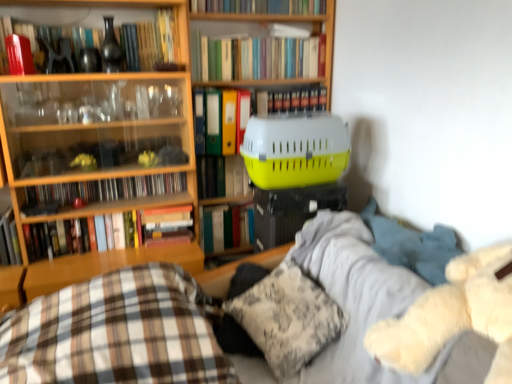
Question: From a real-world perspective, is yellow plastic pet carrier at upper right physically located above or below matte black vase at upper left, the fourth book positioned from the top?

Choices:
 (A) above
 (B) below

Answer: (B)

Question: Is point (331, 172) closer or farther from the camera than point (173, 43)?

Choices:
 (A) farther
 (B) closer

Answer: (B)

Question: Considering the real-world distances, which object is closest to the hardcover book at center, positioned as the tenth book in top-to-bottom order?

Choices:
 (A) hardcover book at upper center, which is the 1th book from top to bottom
 (B) hardcover book at center, the seventh book positioned from the top
 (C) wooden bookcase at center
 (D) yellow plastic pet carrier at upper right
 (E) yellow matte file folder at center, which appears as the 6th book when ordered from the bottom

Answer: (B)

Question: Which is farther from the hardcover book at center, positioned as the tenth book in top-to-bottom order?

Choices:
 (A) yellow plastic pet carrier at upper right
 (B) matte black book at left, placed as the eighth book when sorted from top to bottom
 (C) white fluffy teddy bear at right
 (D) matte black vase at upper left, which is counted as the eighth book, starting from the bottom
 (E) hardcover book at left, which ranks as the 11th book in top-to-bottom order

Answer: (C)